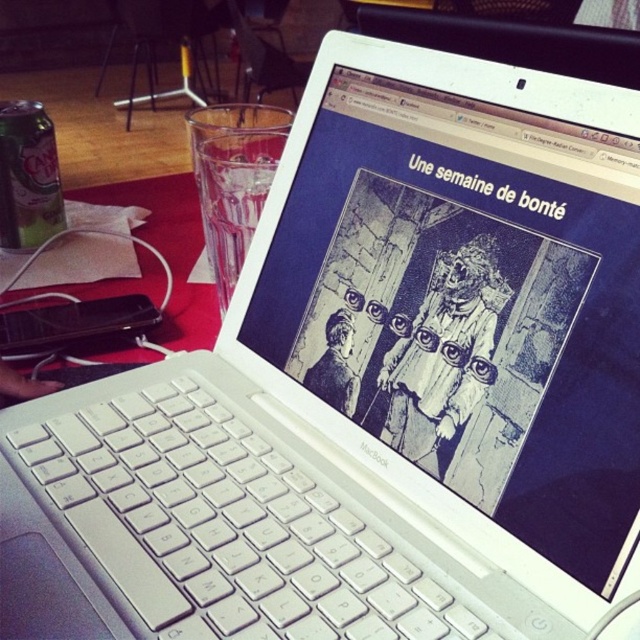
Question: Which point is farther from the camera taking this photo?

Choices:
 (A) (332, 364)
 (B) (3, 228)
 (C) (452, 412)

Answer: (B)

Question: Is white plastic keyboard at center to the left of black paper doll at center from the viewer's perspective?

Choices:
 (A) no
 (B) yes

Answer: (B)

Question: Is the position of white plastic keyboard at center less distant than that of red fabric table at lower left?

Choices:
 (A) no
 (B) yes

Answer: (B)

Question: Which point is closer to the camera taking this photo?

Choices:
 (A) (176, 285)
 (B) (99, 611)

Answer: (B)

Question: Can you confirm if red fabric table at lower left is positioned below green can at left?

Choices:
 (A) yes
 (B) no

Answer: (A)

Question: Estimate the real-world distances between objects in this image. Which object is closer to the green can at left?

Choices:
 (A) black paper bag at center
 (B) white plastic keyboard at center
 (C) black paper doll at center
 (D) red fabric table at lower left

Answer: (D)